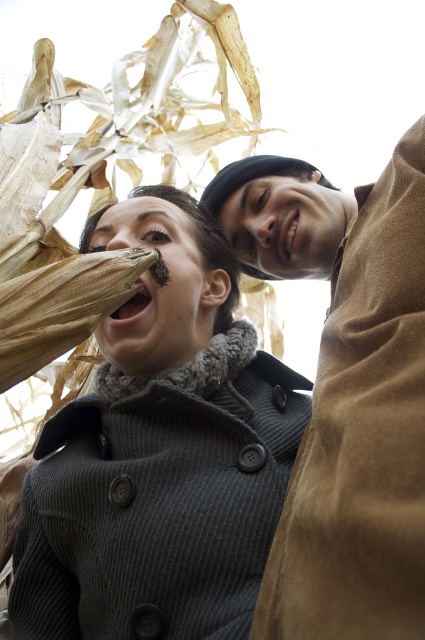
Between dark gray wool coat at center and brown suede coat at upper right, which one appears on the right side from the viewer's perspective?

brown suede coat at upper right is more to the right.

Between point (240, 515) and point (334, 488), which one is positioned in front?

Point (334, 488) is more forward.

Where is `dark gray wool coat at center`? This screenshot has width=425, height=640. dark gray wool coat at center is located at coordinates (159, 452).

Which is more to the left, brown suede coat at upper right or brown textured corn at lower left?

Positioned to the left is brown textured corn at lower left.

Does point (391, 384) come farther from viewer compared to point (76, 307)?

No, it is not.

This screenshot has height=640, width=425. In order to click on brown suede coat at upper right in this screenshot , I will do `click(345, 392)`.

Is dark gray wool coat at center shorter than brown textured corn at lower left?

No.

Who is more distant from viewer, (125, 362) or (136, 260)?

Point (125, 362)

In order to click on dark gray wool coat at center in this screenshot , I will do `click(159, 452)`.